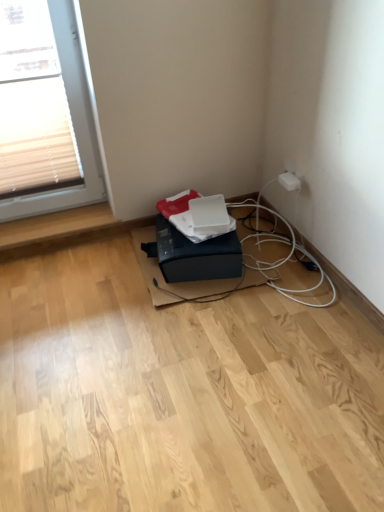
Question: Does black matte printer at lower center have a larger size compared to white plastic electric outlet at upper right?

Choices:
 (A) no
 (B) yes

Answer: (B)

Question: Is the surface of black matte printer at lower center in direct contact with white plastic electric outlet at upper right?

Choices:
 (A) no
 (B) yes

Answer: (A)

Question: From the image's perspective, is black matte printer at lower center under white plastic electric outlet at upper right?

Choices:
 (A) no
 (B) yes

Answer: (B)

Question: From the image's perspective, does black matte printer at lower center appear higher than white plastic electric outlet at upper right?

Choices:
 (A) no
 (B) yes

Answer: (A)

Question: Is black matte printer at lower center surrounding white plastic electric outlet at upper right?

Choices:
 (A) yes
 (B) no

Answer: (B)

Question: Can you confirm if black matte printer at lower center is positioned to the left of white plastic electric outlet at upper right?

Choices:
 (A) no
 (B) yes

Answer: (B)

Question: From the image's perspective, is white plastic electric outlet at upper right located above black matte printer at lower center?

Choices:
 (A) yes
 (B) no

Answer: (A)

Question: From a real-world perspective, is white plastic electric outlet at upper right under black matte printer at lower center?

Choices:
 (A) no
 (B) yes

Answer: (A)

Question: Is white plastic electric outlet at upper right at the right side of black matte printer at lower center?

Choices:
 (A) no
 (B) yes

Answer: (B)

Question: Does white plastic electric outlet at upper right turn towards black matte printer at lower center?

Choices:
 (A) yes
 (B) no

Answer: (B)

Question: Is white plastic electric outlet at upper right bigger than black matte printer at lower center?

Choices:
 (A) yes
 (B) no

Answer: (B)

Question: Is white plastic electric outlet at upper right at the left side of black matte printer at lower center?

Choices:
 (A) yes
 (B) no

Answer: (B)

Question: From a real-world perspective, is black matte printer at lower center positioned above or below white plastic electric outlet at upper right?

Choices:
 (A) above
 (B) below

Answer: (B)